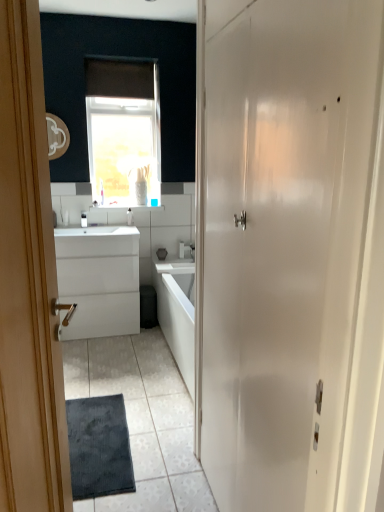
You are a GUI agent. You are given a task and a screenshot of the screen. Output one action in this format:
    pyautogui.click(x=<x>, y=<y>)
    Task: Click on the free region under dark gray textured bath mat at lower center (from a real-world perspective)
    This screenshot has width=384, height=512.
    Given the screenshot: What is the action you would take?
    pyautogui.click(x=107, y=438)